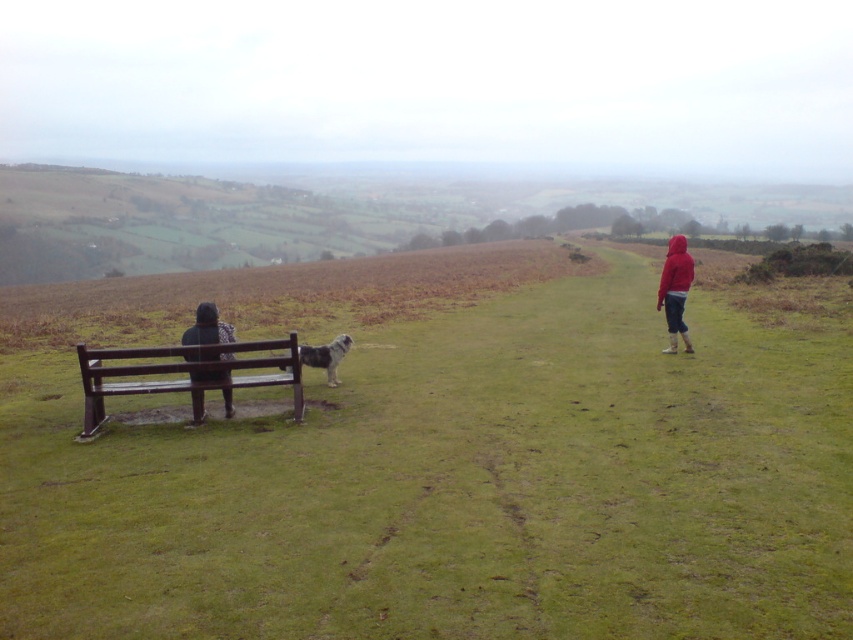
Is brown wooden bench at left below white fluffy dog at center?

Correct, brown wooden bench at left is located below white fluffy dog at center.

Does brown wooden bench at left have a larger size compared to white fluffy dog at center?

Correct, brown wooden bench at left is larger in size than white fluffy dog at center.

Is point (225, 346) behind point (335, 364)?

No, it is in front of (335, 364).

Where is `brown wooden bench at left`? This screenshot has width=853, height=640. brown wooden bench at left is located at coordinates (184, 372).

Where is `green grassy field at center`? green grassy field at center is located at coordinates (457, 486).

Who is more forward, (590, 292) or (190, 332)?

Positioned in front is point (190, 332).

The image size is (853, 640). Identify the location of green grassy field at center. (457, 486).

Who is higher up, green grassy field at center or brown wooden bench at left?

Positioned higher is green grassy field at center.

Is green grassy field at center further to camera compared to brown wooden bench at left?

No, it is not.

Describe the element at coordinates (457, 486) in the screenshot. I see `green grassy field at center` at that location.

In order to click on green grassy field at center in this screenshot , I will do `click(457, 486)`.